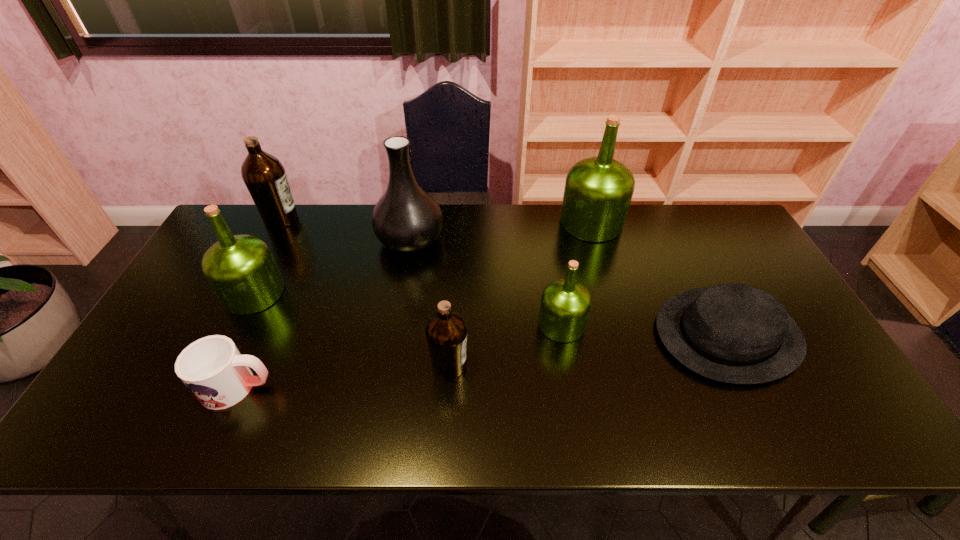
Identify the location of object located at the near edge. The width and height of the screenshot is (960, 540). (212, 368).

In order to click on object that is at the right edge in this screenshot , I will do `click(734, 333)`.

The image size is (960, 540). What are the coordinates of `object located at the far left corner` in the screenshot? It's located at (264, 175).

Identify the location of vacant region at the far edge of the desktop. (677, 246).

Image resolution: width=960 pixels, height=540 pixels. In the image, there is a desktop. What are the coordinates of `free region at the near edge` in the screenshot? It's located at (313, 431).

Where is `free location at the left edge of the desktop`? free location at the left edge of the desktop is located at coordinates (200, 306).

Where is `free region at the right edge of the desktop`? The width and height of the screenshot is (960, 540). free region at the right edge of the desktop is located at coordinates 730,259.

Where is `free space at the near right corner of the desktop`? This screenshot has width=960, height=540. free space at the near right corner of the desktop is located at coordinates (789, 419).

Find the location of `unoccupied position between the leftmost green olive oil and the mug`. unoccupied position between the leftmost green olive oil and the mug is located at coordinates (246, 340).

Identify the location of vacant area that lies between the black fedora and the smallest green olive oil. (644, 329).